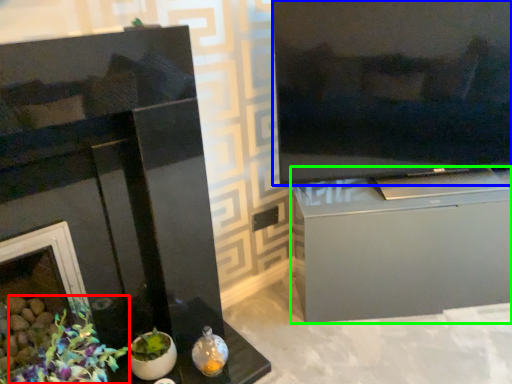
Question: Which is nearer to the floral arrangement (highlighted by a red box)? television (highlighted by a blue box) or cabinetry (highlighted by a green box).

Choices:
 (A) television
 (B) cabinetry

Answer: (B)